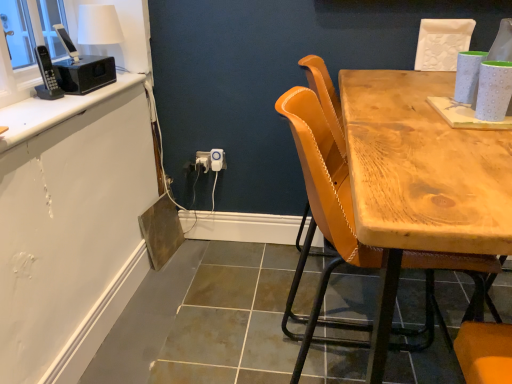
Question: Which direction should I rotate to look at white plastic power outlet at center, positioned as the 2th power outlet in left-to-right order, — up or down?

Choices:
 (A) down
 (B) up

Answer: (B)

Question: Does white plastic power outlet at center, positioned as the 2th power outlet in left-to-right order, come behind white glossy countertop at upper left?

Choices:
 (A) no
 (B) yes

Answer: (B)

Question: Can you confirm if white plastic power outlet at center, positioned as the 2th power outlet in left-to-right order, is smaller than white glossy countertop at upper left?

Choices:
 (A) no
 (B) yes

Answer: (B)

Question: Is white plastic power outlet at center, which is the first power outlet in right-to-left order, looking in the opposite direction of white glossy countertop at upper left?

Choices:
 (A) no
 (B) yes

Answer: (A)

Question: Is white plastic power outlet at center, positioned as the 2th power outlet in left-to-right order, placed right next to white glossy countertop at upper left?

Choices:
 (A) no
 (B) yes

Answer: (A)

Question: Considering the relative positions of white plastic power outlet at center, positioned as the 2th power outlet in left-to-right order, and white glossy countertop at upper left in the image provided, is white plastic power outlet at center, positioned as the 2th power outlet in left-to-right order, to the right of white glossy countertop at upper left from the viewer's perspective?

Choices:
 (A) no
 (B) yes

Answer: (B)

Question: Is the depth of white plastic power outlet at center, positioned as the 2th power outlet in left-to-right order, less than that of white glossy countertop at upper left?

Choices:
 (A) yes
 (B) no

Answer: (B)

Question: Could white plastic power outlet at center, which is the first power outlet in right-to-left order, be considered to be inside white glossy countertop at upper left?

Choices:
 (A) no
 (B) yes

Answer: (A)

Question: Is white glossy countertop at upper left outside white plastic power outlet at center, which is the first power outlet in right-to-left order?

Choices:
 (A) no
 (B) yes

Answer: (B)

Question: From a real-world perspective, is white glossy countertop at upper left physically above white plastic power outlet at center, positioned as the 2th power outlet in left-to-right order?

Choices:
 (A) yes
 (B) no

Answer: (A)

Question: From the image's perspective, is white glossy countertop at upper left under white plastic power outlet at center, which is the first power outlet in right-to-left order?

Choices:
 (A) no
 (B) yes

Answer: (A)

Question: Is white glossy countertop at upper left behind white plastic power outlet at center, which is the first power outlet in right-to-left order?

Choices:
 (A) yes
 (B) no

Answer: (B)

Question: Is white glossy countertop at upper left shorter than white plastic power outlet at center, positioned as the 2th power outlet in left-to-right order?

Choices:
 (A) no
 (B) yes

Answer: (B)

Question: Is white glossy countertop at upper left bigger than white plastic power outlet at lower center, marked as the 1th power outlet in a left-to-right arrangement?

Choices:
 (A) no
 (B) yes

Answer: (B)